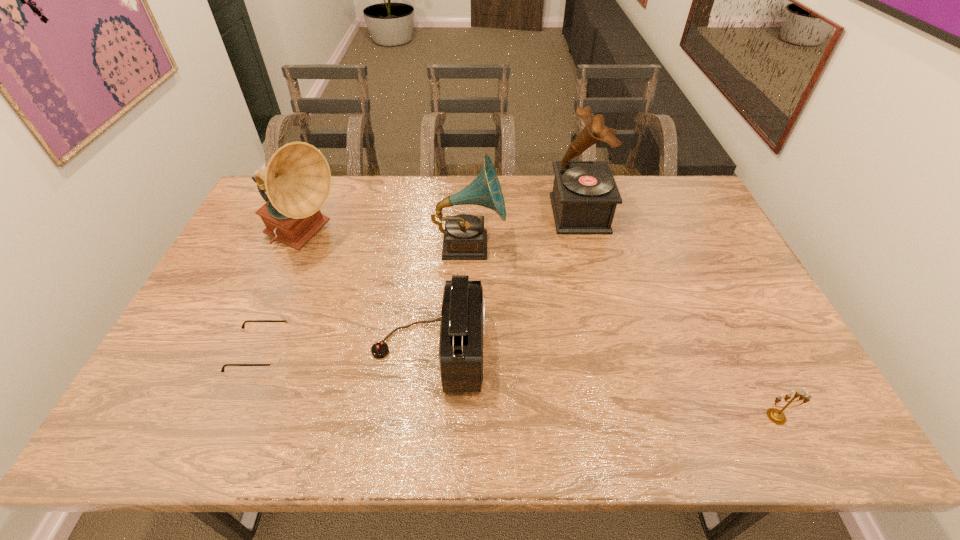
You are a GUI agent. You are given a task and a screenshot of the screen. Output one action in this format:
    pyautogui.click(x=<x>, y=<y>)
    Task: Click on the vacant space located 0.270m at the horn opening of the second object from right to left
    
    Given the screenshot: What is the action you would take?
    (x=472, y=213)

Locate an element on the screen. The image size is (960, 540). free spot located 0.260m on the horn of the leftmost phonograph_record is located at coordinates (427, 239).

This screenshot has width=960, height=540. I want to click on vacant space located from the horn of the fourth shortest object, so click(x=588, y=245).

Locate an element on the screen. The image size is (960, 540). vacant space situated on the front-facing side of the radio receiver is located at coordinates (561, 349).

At what (x,y) coordinates should I click in order to perform the action: click on vacant space situated on the back of the rightmost object. Please return your answer as a coordinate pair (x, y). This screenshot has width=960, height=540. Looking at the image, I should click on (728, 319).

Where is `blank space located at the hinge ends of the shortest object`? This screenshot has width=960, height=540. blank space located at the hinge ends of the shortest object is located at coordinates (443, 351).

The height and width of the screenshot is (540, 960). What are the coordinates of `object that is at the near edge` in the screenshot? It's located at (777, 416).

This screenshot has width=960, height=540. Find the location of `phonograph record positioned at the left edge`. phonograph record positioned at the left edge is located at coordinates (297, 179).

Identify the location of spectacles that is at the left edge. (276, 359).

Locate an element on the screen. object at the right edge is located at coordinates (777, 416).